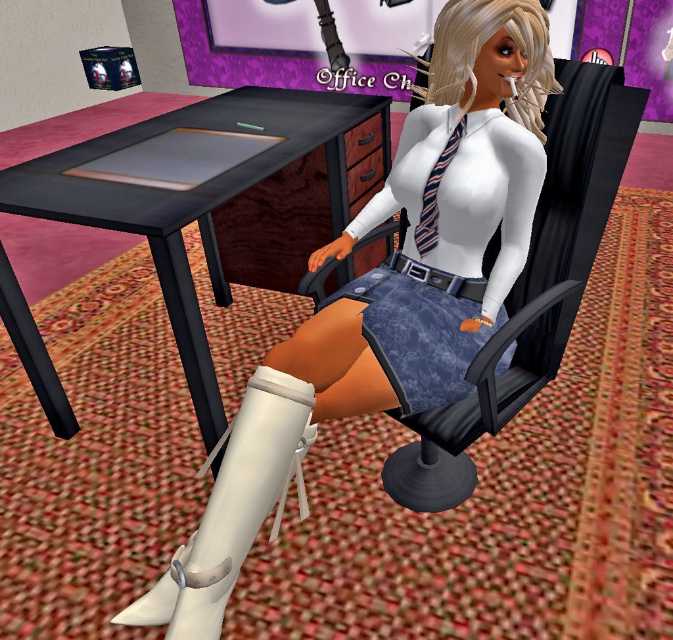
You are an office worker who needs to adjust your clothing before an important meeting. You see the matte black swivel chair at center and the striped fabric tie at center. Which item is positioned lower from the floor?

The matte black swivel chair at center is located below striped fabric tie at center, so the matte black swivel chair at center is positioned lower from the floor.

You are an office worker who needs to move the white matte boot at lower center to the other side of the desk. Considering the size of the matte black swivel chair at center, will you have enough space to move around it?

The matte black swivel chair at center is bigger than the white matte boot at lower center, so there should be enough space to move around it since the chair takes up more area, allowing room to maneuver the boot.